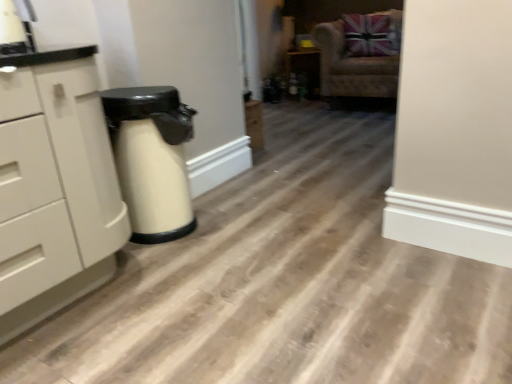
Question: Does velvet beige armchair at upper right appear on the left side of matte black cabinet at center?

Choices:
 (A) no
 (B) yes

Answer: (A)

Question: Is velvet beige armchair at upper right beside matte black cabinet at center?

Choices:
 (A) no
 (B) yes

Answer: (A)

Question: Is velvet beige armchair at upper right closer to camera compared to matte black cabinet at center?

Choices:
 (A) no
 (B) yes

Answer: (B)

Question: Can we say velvet beige armchair at upper right lies outside matte black cabinet at center?

Choices:
 (A) yes
 (B) no

Answer: (A)

Question: Does velvet beige armchair at upper right turn towards matte black cabinet at center?

Choices:
 (A) yes
 (B) no

Answer: (B)

Question: Considering their positions, is velvet beige armchair at upper right located in front of or behind matte black cabinet at center?

Choices:
 (A) front
 (B) behind

Answer: (A)

Question: From the image's perspective, is velvet beige armchair at upper right above or below matte black cabinet at center?

Choices:
 (A) above
 (B) below

Answer: (B)

Question: From a real-world perspective, is velvet beige armchair at upper right above or below matte black cabinet at center?

Choices:
 (A) below
 (B) above

Answer: (B)

Question: Is velvet beige armchair at upper right bigger or smaller than matte black cabinet at center?

Choices:
 (A) small
 (B) big

Answer: (B)

Question: Does point (68, 102) appear closer or farther from the camera than point (313, 79)?

Choices:
 (A) farther
 (B) closer

Answer: (B)

Question: From their relative heights in the image, would you say white matte chest of drawers at left is taller or shorter than matte black cabinet at center?

Choices:
 (A) short
 (B) tall

Answer: (B)

Question: Is white matte chest of drawers at left wider or thinner than matte black cabinet at center?

Choices:
 (A) thin
 (B) wide

Answer: (B)

Question: Is white matte chest of drawers at left spatially inside matte black cabinet at center, or outside of it?

Choices:
 (A) outside
 (B) inside

Answer: (A)

Question: Is velvet beige armchair at upper right to the left or to the right of white matte chest of drawers at left in the image?

Choices:
 (A) right
 (B) left

Answer: (A)

Question: In terms of size, does velvet beige armchair at upper right appear bigger or smaller than white matte chest of drawers at left?

Choices:
 (A) small
 (B) big

Answer: (B)